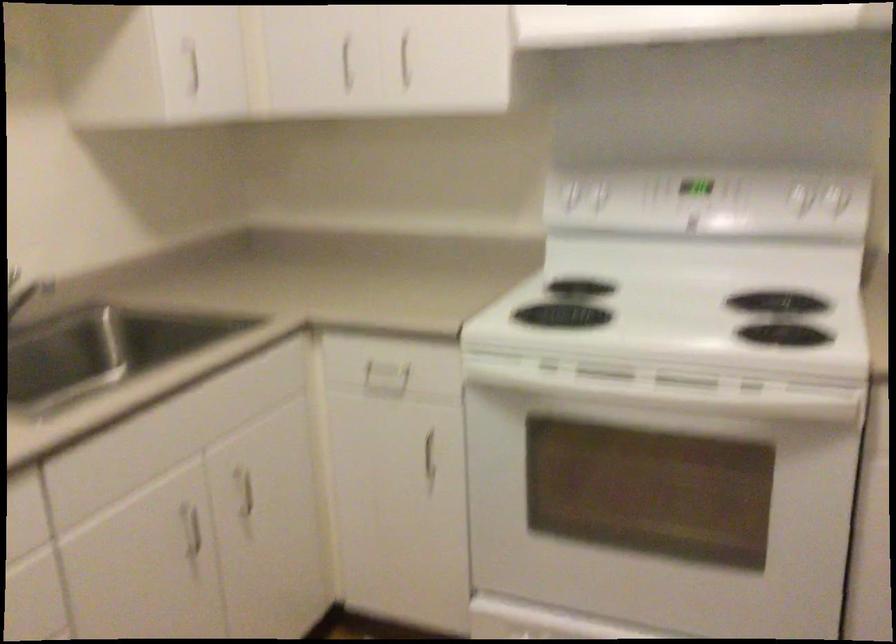
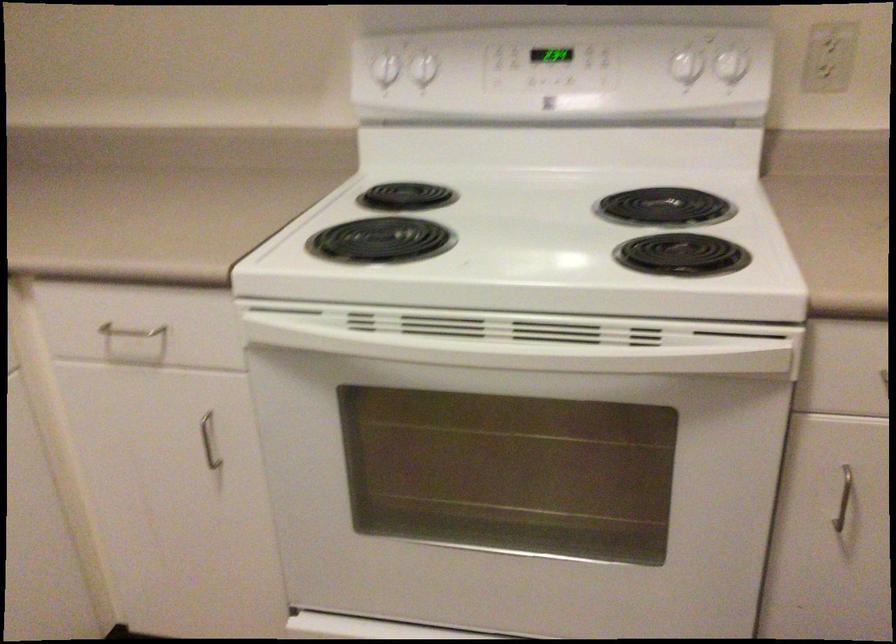
Where in the second image is the point corresponding to point (385, 375) from the first image?

(136, 337)